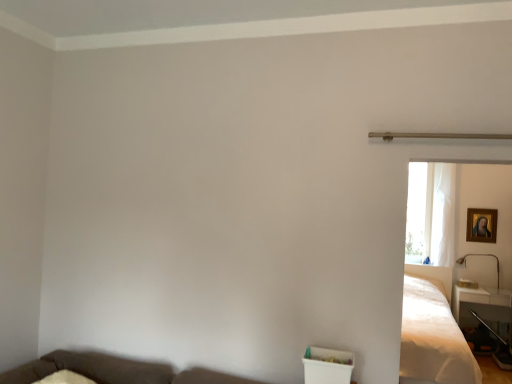
Question: Is white sheer curtain at right shorter than metallic gold lamp at right?

Choices:
 (A) no
 (B) yes

Answer: (A)

Question: Considering the relative sizes of white sheer curtain at right and metallic gold lamp at right in the image provided, is white sheer curtain at right wider than metallic gold lamp at right?

Choices:
 (A) no
 (B) yes

Answer: (A)

Question: Is white sheer curtain at right positioned behind metallic gold lamp at right?

Choices:
 (A) yes
 (B) no

Answer: (A)

Question: Does white sheer curtain at right contain metallic gold lamp at right?

Choices:
 (A) yes
 (B) no

Answer: (B)

Question: Can you confirm if white sheer curtain at right is taller than metallic gold lamp at right?

Choices:
 (A) no
 (B) yes

Answer: (B)

Question: From a real-world perspective, is white sheer curtain at right positioned under metallic gold lamp at right based on gravity?

Choices:
 (A) no
 (B) yes

Answer: (A)

Question: Can you confirm if gold-framed painting at upper right is positioned to the left of white satin bed at right?

Choices:
 (A) yes
 (B) no

Answer: (B)

Question: From a real-world perspective, is gold-framed painting at upper right positioned under white satin bed at right based on gravity?

Choices:
 (A) yes
 (B) no

Answer: (B)

Question: Considering the relative sizes of gold-framed painting at upper right and white satin bed at right in the image provided, is gold-framed painting at upper right wider than white satin bed at right?

Choices:
 (A) yes
 (B) no

Answer: (B)

Question: Is white satin bed at right a part of gold-framed painting at upper right?

Choices:
 (A) yes
 (B) no

Answer: (B)

Question: Is gold-framed painting at upper right at the right side of white satin bed at right?

Choices:
 (A) no
 (B) yes

Answer: (B)

Question: Is gold-framed painting at upper right facing away from white satin bed at right?

Choices:
 (A) yes
 (B) no

Answer: (B)

Question: Does metallic gold lamp at right have a larger size compared to brown fabric couch at lower left?

Choices:
 (A) yes
 (B) no

Answer: (B)